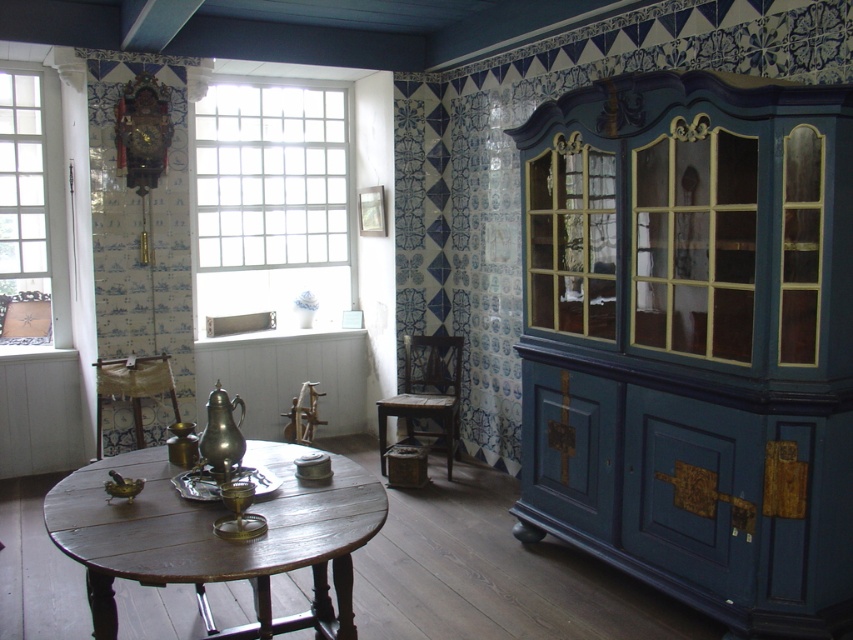
Question: Can you confirm if wooden polished table at center is thinner than clear glass window at left?

Choices:
 (A) yes
 (B) no

Answer: (B)

Question: In this image, where is clear glass window at left located relative to wooden chair at center?

Choices:
 (A) above
 (B) below

Answer: (A)

Question: Which object is the farthest from the clear glass window at left?

Choices:
 (A) wooden chair at center
 (B) white glass window at center
 (C) wooden polished table at center

Answer: (C)

Question: Among these points, which one is nearest to the camera?

Choices:
 (A) (91, 593)
 (B) (221, 134)
 (C) (408, 362)
 (D) (15, 260)

Answer: (A)

Question: Is wooden polished table at center to the right of wooden chair at center from the viewer's perspective?

Choices:
 (A) yes
 (B) no

Answer: (B)

Question: Which object is positioned farthest from the wooden chair at center?

Choices:
 (A) wooden polished table at center
 (B) white glass window at center

Answer: (A)